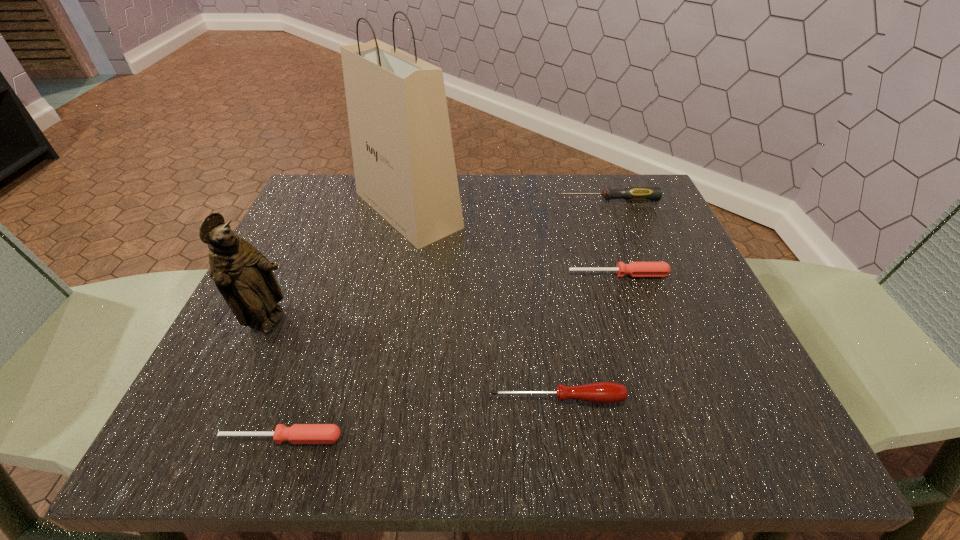
Identify the location of object that stands as the second closest to the fourth farthest object. Image resolution: width=960 pixels, height=540 pixels. (403, 157).

Choose which object is the fifth nearest neighbor to the farthest screwdriver. Please provide its 2D coordinates. Your answer should be formatted as a tuple, i.e. [(x, y)], where the tuple contains the x and y coordinates of a point satisfying the conditions above.

[(298, 433)]

Locate which screwdriver ranks in proximity to the second nearest screwdriver. Please provide its 2D coordinates. Your answer should be formatted as a tuple, i.e. [(x, y)], where the tuple contains the x and y coordinates of a point satisfying the conditions above.

[(298, 433)]

Locate which screwdriver ranks second in proximity to the third nearest screwdriver. Please provide its 2D coordinates. Your answer should be formatted as a tuple, i.e. [(x, y)], where the tuple contains the x and y coordinates of a point satisfying the conditions above.

[(600, 392)]

Where is `vacant area that satisfies the following two spatial constraints: 1. on the front-facing side of the fifth shortest object; 2. on the back side of the nearest object`? This screenshot has height=540, width=960. vacant area that satisfies the following two spatial constraints: 1. on the front-facing side of the fifth shortest object; 2. on the back side of the nearest object is located at coordinates (217, 438).

At what (x,y) coordinates should I click in order to perform the action: click on free space in the image that satisfies the following two spatial constraints: 1. on the front-facing side of the nearest object; 2. on the right side of the second tallest object. Please return your answer as a coordinate pair (x, y). The height and width of the screenshot is (540, 960). Looking at the image, I should click on (217, 438).

Where is `free space that satisfies the following two spatial constraints: 1. insert the farthest screwdriver into a screw head; 2. on the front side of the second farthest screwdriver`? The width and height of the screenshot is (960, 540). free space that satisfies the following two spatial constraints: 1. insert the farthest screwdriver into a screw head; 2. on the front side of the second farthest screwdriver is located at coordinates (636, 274).

Locate an element on the screen. This screenshot has height=540, width=960. vacant space that satisfies the following two spatial constraints: 1. insert the farthest screwdriver into a screw head; 2. on the front side of the second nearest screwdriver is located at coordinates (684, 399).

This screenshot has height=540, width=960. Identify the location of vacant space that satisfies the following two spatial constraints: 1. insert the farthest screwdriver into a screw head; 2. on the front side of the shopping bag. (612, 210).